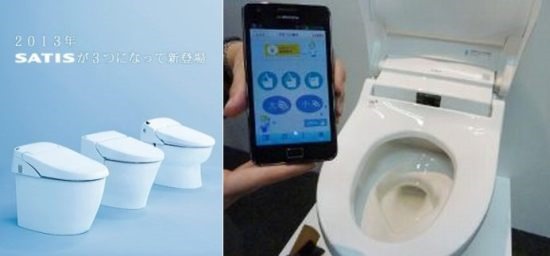
This screenshot has height=256, width=550. I want to click on toilet lids, so click(73, 162), click(131, 149), click(181, 131), click(472, 9).